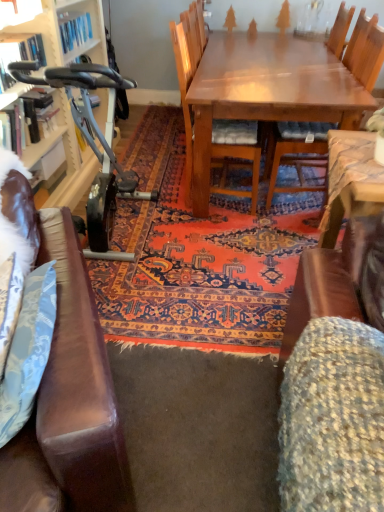
You are a GUI agent. You are given a task and a screenshot of the screen. Output one action in this format:
    pyautogui.click(x=<x>, y=<y>)
    Task: Click on the empty space that is in between wooden chair at center, which is counted as the first chair, starting from the left, and metallic blue exercise bike at left
    This screenshot has height=512, width=384.
    Given the screenshot: What is the action you would take?
    pyautogui.click(x=195, y=231)